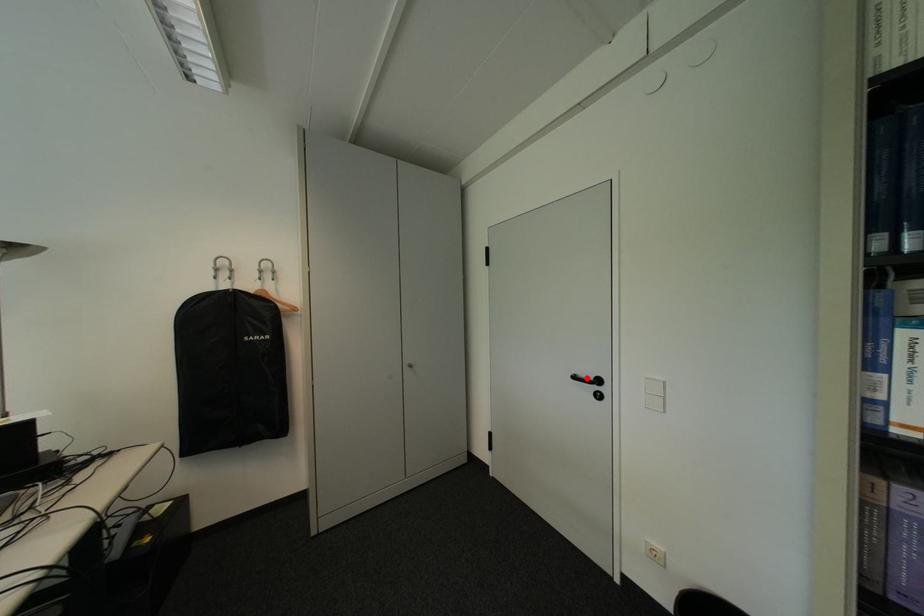
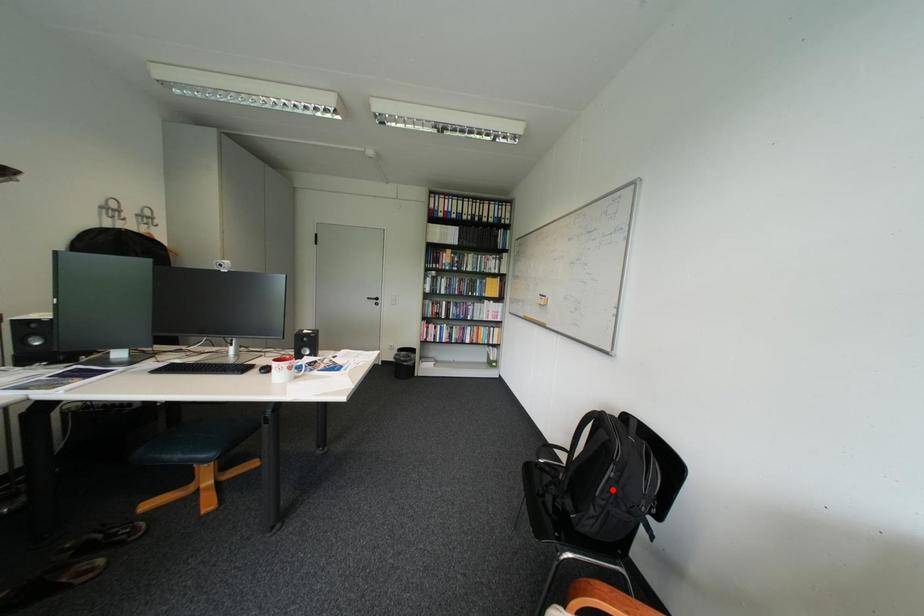
I am providing you with two images of the same scene from different viewpoints. A red point is marked on the first image and another point is marked on the second image. Is the red point in image1 aligned with the point shown in image2?

No